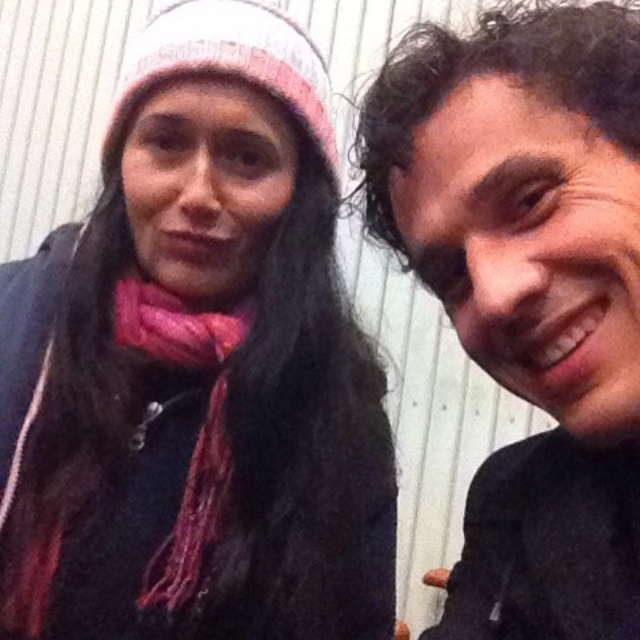
Is matte black shirt at right closer to the viewer compared to pink knitted scarf at left?

Yes, it is in front of pink knitted scarf at left.

Which is behind, point (492, 248) or point (184, 538)?

The point (184, 538) is behind.

Identify the location of matte black shirt at right. Image resolution: width=640 pixels, height=640 pixels. (x=529, y=291).